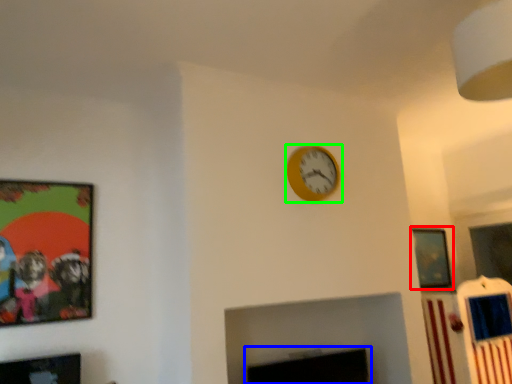
Question: Which object is the farthest from picture frame (highlighted by a red box)? Choose among these: fireplace (highlighted by a blue box) or wall clock (highlighted by a green box).

Choices:
 (A) fireplace
 (B) wall clock

Answer: (B)